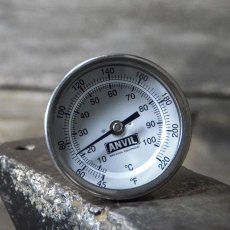
This screenshot has height=230, width=230. I want to click on wall, so click(25, 102).